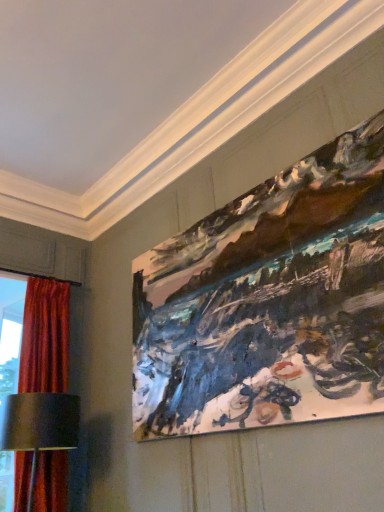
Question: Does painted canvas at upper right have a smaller size compared to velvet red curtain at left?

Choices:
 (A) yes
 (B) no

Answer: (A)

Question: Does painted canvas at upper right have a lesser width compared to velvet red curtain at left?

Choices:
 (A) yes
 (B) no

Answer: (A)

Question: Is painted canvas at upper right placed right next to velvet red curtain at left?

Choices:
 (A) yes
 (B) no

Answer: (B)

Question: Is painted canvas at upper right further to camera compared to velvet red curtain at left?

Choices:
 (A) yes
 (B) no

Answer: (B)

Question: Is painted canvas at upper right taller than velvet red curtain at left?

Choices:
 (A) yes
 (B) no

Answer: (B)

Question: Is point (6, 401) closer or farther from the camera than point (299, 414)?

Choices:
 (A) farther
 (B) closer

Answer: (A)

Question: In terms of height, does metallic silver table lamp at lower left look taller or shorter compared to painted canvas at upper right?

Choices:
 (A) short
 (B) tall

Answer: (A)

Question: From the image's perspective, relative to painted canvas at upper right, is metallic silver table lamp at lower left above or below?

Choices:
 (A) above
 (B) below

Answer: (B)

Question: From a real-world perspective, relative to painted canvas at upper right, is metallic silver table lamp at lower left vertically above or below?

Choices:
 (A) above
 (B) below

Answer: (B)

Question: Is velvet red curtain at left taller or shorter than metallic silver table lamp at lower left?

Choices:
 (A) tall
 (B) short

Answer: (A)

Question: Considering the positions of point (31, 373) and point (16, 408), is point (31, 373) closer or farther from the camera than point (16, 408)?

Choices:
 (A) farther
 (B) closer

Answer: (A)

Question: From the image's perspective, is velvet red curtain at left above or below metallic silver table lamp at lower left?

Choices:
 (A) below
 (B) above

Answer: (B)

Question: Is velvet red curtain at left inside the boundaries of metallic silver table lamp at lower left, or outside?

Choices:
 (A) inside
 (B) outside

Answer: (B)

Question: Is velvet red curtain at left taller or shorter than painted canvas at upper right?

Choices:
 (A) tall
 (B) short

Answer: (A)

Question: Is point (61, 499) closer or farther from the camera than point (195, 239)?

Choices:
 (A) closer
 (B) farther

Answer: (B)